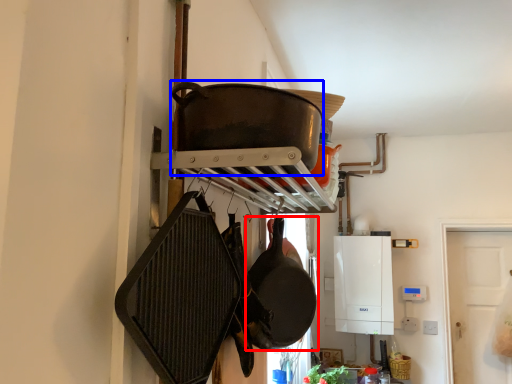
Question: Which point is closer to the camera, frying pan (highlighted by a red box) or wok (highlighted by a blue box)?

Choices:
 (A) frying pan
 (B) wok

Answer: (B)